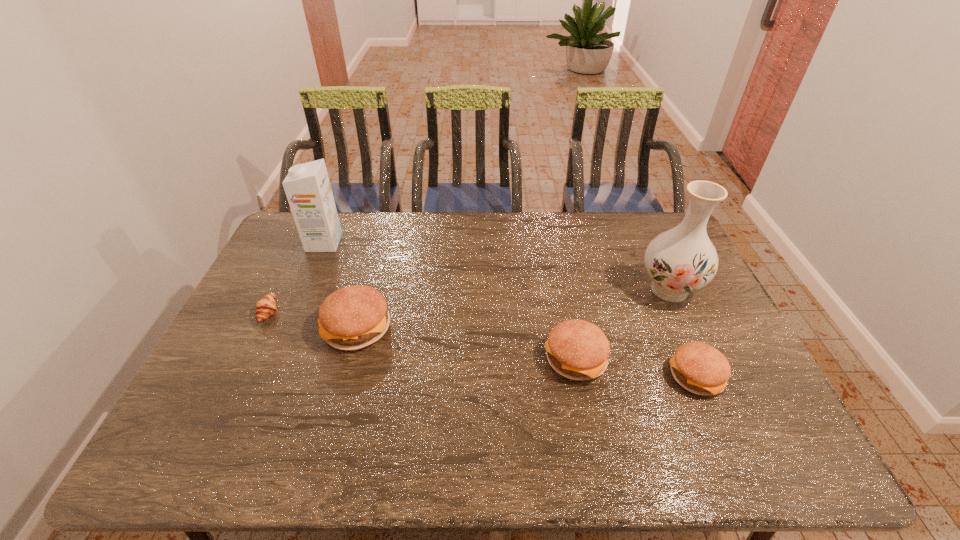
Locate an element on the screen. vase that is at the right edge is located at coordinates (681, 260).

Find the location of a particular element. The image size is (960, 540). object present at the far left corner is located at coordinates coord(307,187).

Locate an element on the screen. Image resolution: width=960 pixels, height=540 pixels. object present at the near right corner is located at coordinates (699, 368).

I want to click on blank area at the far edge, so click(x=454, y=214).

In the image, there is a desktop. Where is `free space at the near edge`? The image size is (960, 540). free space at the near edge is located at coordinates (284, 421).

In the image, there is a desktop. At what (x,y) coordinates should I click in order to perform the action: click on vacant area at the left edge. Please return your answer as a coordinate pair (x, y). The height and width of the screenshot is (540, 960). Looking at the image, I should click on (226, 381).

Locate an element on the screen. This screenshot has width=960, height=540. free space at the right edge is located at coordinates click(699, 309).

This screenshot has height=540, width=960. What are the coordinates of `vacant point located between the shortest object and the third object from left to right` in the screenshot? It's located at (313, 319).

The image size is (960, 540). Find the location of `blank region between the second hamburger from left to right and the second tallest object`. blank region between the second hamburger from left to right and the second tallest object is located at coordinates (449, 301).

I want to click on free spot between the fifth shortest object and the leftmost hamburger, so click(341, 285).